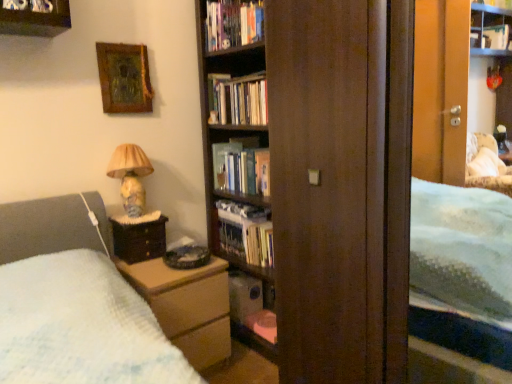
This screenshot has width=512, height=384. I want to click on free space above brown wood nightstand at left (from a real-world perspective), so click(134, 216).